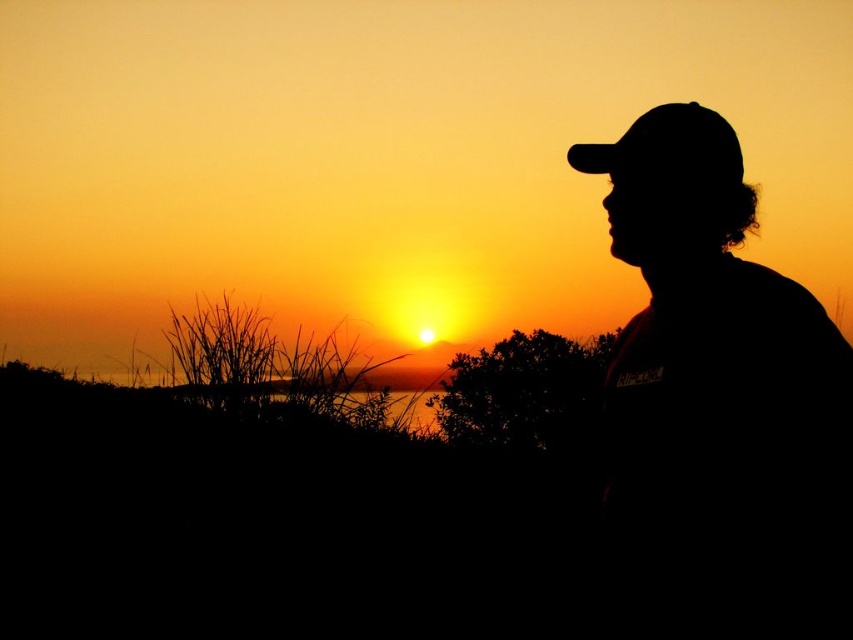
Is silhouette cap at right to the left of black matte cap at right from the viewer's perspective?

In fact, silhouette cap at right is to the right of black matte cap at right.

Between silhouette cap at right and black matte cap at right, which one has more height?

With more height is silhouette cap at right.

Which is in front, point (641, 179) or point (660, 156)?

Point (660, 156) is in front.

Where is `silhouette cap at right`? silhouette cap at right is located at coordinates (718, 403).

Does black matte cap at right appear under black matte baseball hat at upper right?

Correct, black matte cap at right is located below black matte baseball hat at upper right.

Is the position of black matte cap at right less distant than that of black matte baseball hat at upper right?

Yes, it is in front of black matte baseball hat at upper right.

Find the location of a particular element. black matte cap at right is located at coordinates (671, 182).

Where is `black matte cap at right`? The width and height of the screenshot is (853, 640). black matte cap at right is located at coordinates (671, 182).

Does silhouette cap at right appear on the left side of black matte baseball hat at upper right?

In fact, silhouette cap at right is to the right of black matte baseball hat at upper right.

Which is below, silhouette cap at right or black matte baseball hat at upper right?

silhouette cap at right is lower down.

Does point (669, 509) come behind point (703, 112)?

No, it is not.

This screenshot has width=853, height=640. Identify the location of silhouette cap at right. (718, 403).